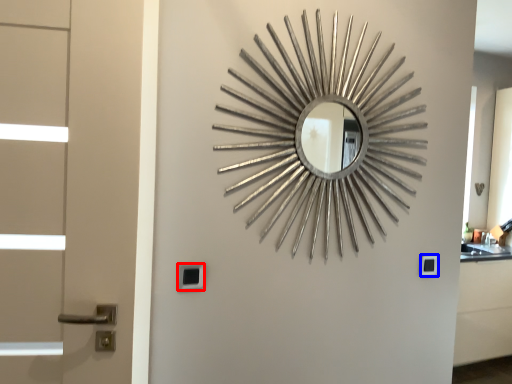
Question: Which of the following is the farthest to the observer, lock (highlighted by a red box) or lock (highlighted by a blue box)?

Choices:
 (A) lock
 (B) lock

Answer: (B)